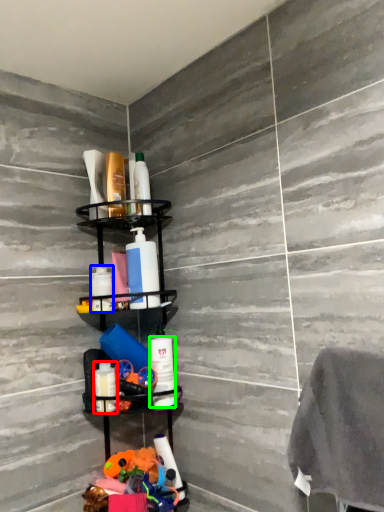
Question: Which object is positioned closest to toiletry (highlighted by a red box)? Select from toiletry (highlighted by a blue box) and toiletry (highlighted by a green box).

Choices:
 (A) toiletry
 (B) toiletry

Answer: (B)